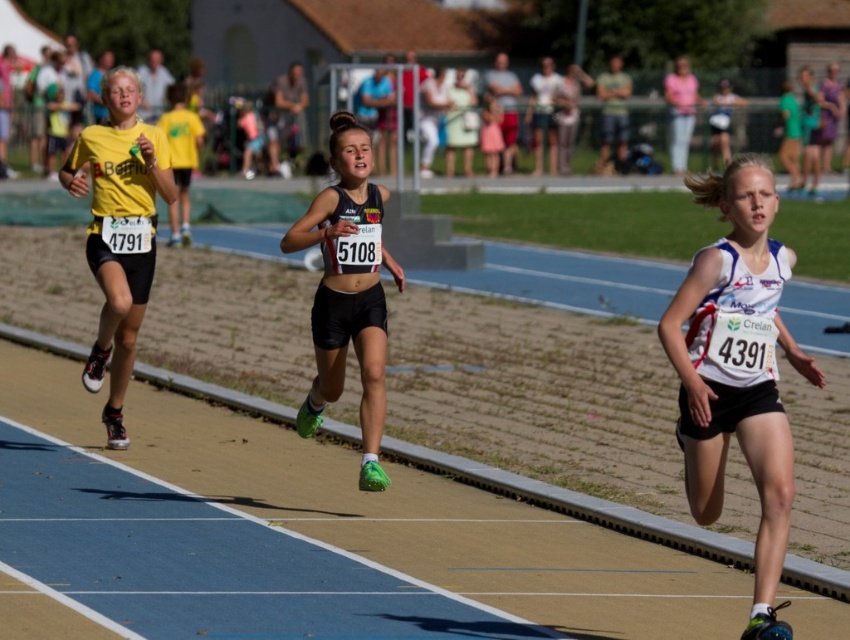
You are a photographer at the track and field event. You want to capture a photo of the athlete wearing the white fabric tank top at center and the matte black shorts at center. Which clothing item should you focus on first if you want to ensure both are in frame?

The white fabric tank top at center is below the matte black shorts at center, so you should focus on the matte black shorts at center first to ensure both items are in frame.

Consider the image. You are a photographer standing at the starting line of the track and want to take a photo that includes both the point at (x=745, y=300) and the point at (x=128, y=337). Which point will appear larger in the photo?

The point at (x=745, y=300) will appear larger in the photo because it is closer to the camera than the point at (x=128, y=337).